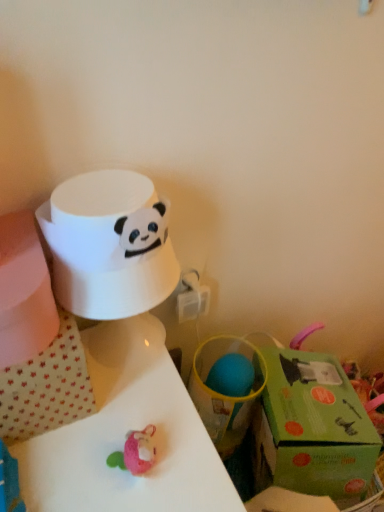
Question: From a real-world perspective, is green cardboard gift box at lower right physically above white glossy table at center?

Choices:
 (A) yes
 (B) no

Answer: (A)

Question: From a real-world perspective, is green cardboard gift box at lower right physically below white glossy table at center?

Choices:
 (A) no
 (B) yes

Answer: (A)

Question: Can you confirm if green cardboard gift box at lower right is shorter than white glossy table at center?

Choices:
 (A) yes
 (B) no

Answer: (A)

Question: From the image's perspective, is green cardboard gift box at lower right below white glossy table at center?

Choices:
 (A) no
 (B) yes

Answer: (A)

Question: Considering the relative sizes of green cardboard gift box at lower right and white glossy table at center in the image provided, is green cardboard gift box at lower right wider than white glossy table at center?

Choices:
 (A) yes
 (B) no

Answer: (B)

Question: Relative to white glossy table at center, is white matte paper towel at upper left in front or behind?

Choices:
 (A) front
 (B) behind

Answer: (B)

Question: In terms of width, does white matte paper towel at upper left look wider or thinner when compared to white glossy table at center?

Choices:
 (A) wide
 (B) thin

Answer: (B)

Question: Considering the positions of white matte paper towel at upper left and white glossy table at center in the image, is white matte paper towel at upper left taller or shorter than white glossy table at center?

Choices:
 (A) short
 (B) tall

Answer: (A)

Question: Would you say white matte paper towel at upper left is to the left or to the right of white glossy table at center in the picture?

Choices:
 (A) right
 (B) left

Answer: (A)

Question: Considering the positions of point (142, 230) and point (269, 441), is point (142, 230) closer or farther from the camera than point (269, 441)?

Choices:
 (A) farther
 (B) closer

Answer: (B)

Question: From a real-world perspective, is white matte paper towel at upper left positioned above or below green cardboard gift box at lower right?

Choices:
 (A) above
 (B) below

Answer: (A)

Question: Considering their positions, is white matte paper towel at upper left located in front of or behind green cardboard gift box at lower right?

Choices:
 (A) behind
 (B) front

Answer: (B)

Question: In terms of height, does white matte paper towel at upper left look taller or shorter compared to green cardboard gift box at lower right?

Choices:
 (A) tall
 (B) short

Answer: (A)

Question: In terms of size, does green cardboard gift box at lower right appear bigger or smaller than white glossy table at center?

Choices:
 (A) small
 (B) big

Answer: (A)

Question: In terms of height, does green cardboard gift box at lower right look taller or shorter compared to white glossy table at center?

Choices:
 (A) short
 (B) tall

Answer: (A)